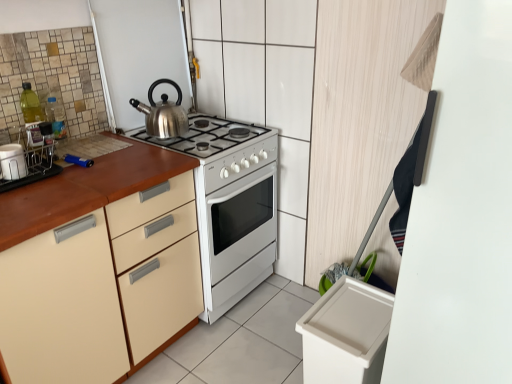
Question: Does satin silver kettle at upper center have a smaller size compared to matte white container at left?

Choices:
 (A) no
 (B) yes

Answer: (A)

Question: Considering the relative sizes of satin silver kettle at upper center and matte white container at left in the image provided, is satin silver kettle at upper center bigger than matte white container at left?

Choices:
 (A) no
 (B) yes

Answer: (B)

Question: Can you confirm if satin silver kettle at upper center is shorter than matte white container at left?

Choices:
 (A) yes
 (B) no

Answer: (B)

Question: Considering the relative sizes of satin silver kettle at upper center and matte white container at left in the image provided, is satin silver kettle at upper center taller than matte white container at left?

Choices:
 (A) yes
 (B) no

Answer: (A)

Question: Is satin silver kettle at upper center completely or partially outside of matte white container at left?

Choices:
 (A) no
 (B) yes

Answer: (B)

Question: Is matte white container at left at the back of satin silver kettle at upper center?

Choices:
 (A) yes
 (B) no

Answer: (B)

Question: Can you confirm if matte wood cabinet at left is smaller than satin silver kettle at upper center?

Choices:
 (A) yes
 (B) no

Answer: (B)

Question: Is matte wood cabinet at left oriented away from satin silver kettle at upper center?

Choices:
 (A) no
 (B) yes

Answer: (A)

Question: From the image's perspective, would you say matte wood cabinet at left is shown under satin silver kettle at upper center?

Choices:
 (A) yes
 (B) no

Answer: (A)

Question: Can you confirm if matte wood cabinet at left is shorter than satin silver kettle at upper center?

Choices:
 (A) no
 (B) yes

Answer: (A)

Question: From a real-world perspective, is matte wood cabinet at left located beneath satin silver kettle at upper center?

Choices:
 (A) no
 (B) yes

Answer: (B)

Question: Can you confirm if matte wood cabinet at left is positioned to the right of satin silver kettle at upper center?

Choices:
 (A) no
 (B) yes

Answer: (A)

Question: Is matte white container at left shorter than satin silver kettle at upper center?

Choices:
 (A) no
 (B) yes

Answer: (B)